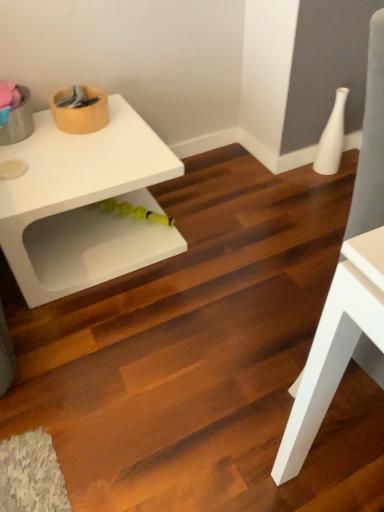
The image size is (384, 512). In order to click on free space to the right of white glossy vase at upper right in this screenshot , I will do point(347,165).